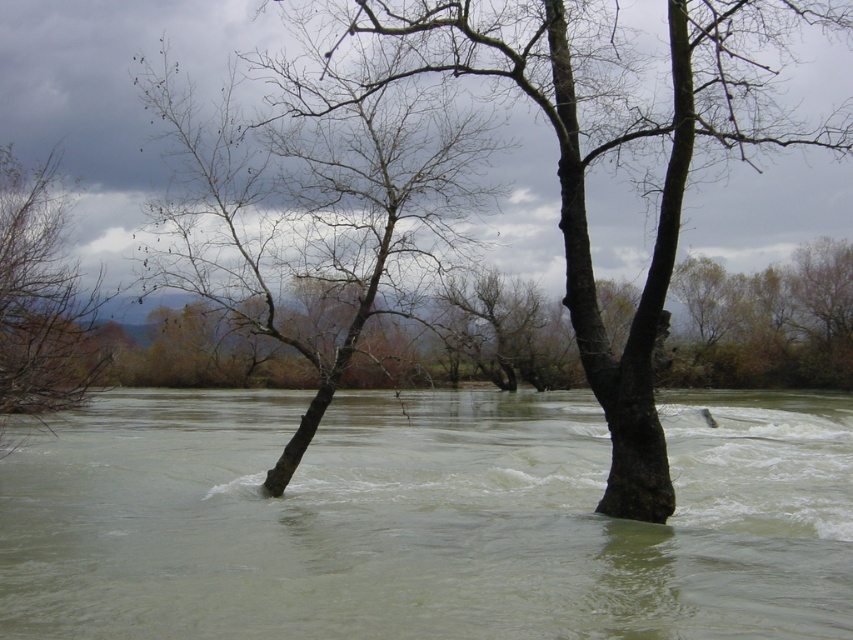
Question: Which object is closer to the camera taking this photo?

Choices:
 (A) bare wood tree at center
 (B) bare branches at left

Answer: (B)

Question: Is bare wood tree at center to the right of bare branches at left from the viewer's perspective?

Choices:
 (A) no
 (B) yes

Answer: (B)

Question: Based on their relative distances, which object is nearer to the brown rough tree at center?

Choices:
 (A) muddy water at center
 (B) bare branches at left
 (C) bare wood tree at center

Answer: (C)

Question: Considering the relative positions of muddy water at center and bare branches at left in the image provided, where is muddy water at center located with respect to bare branches at left?

Choices:
 (A) right
 (B) left

Answer: (A)

Question: Which is nearer to the muddy water at center?

Choices:
 (A) bare wood tree at center
 (B) brown rough tree at center
 (C) bare branches at left

Answer: (B)

Question: Considering the relative positions of muddy water at center and bare wood tree at center in the image provided, where is muddy water at center located with respect to bare wood tree at center?

Choices:
 (A) left
 (B) right

Answer: (B)